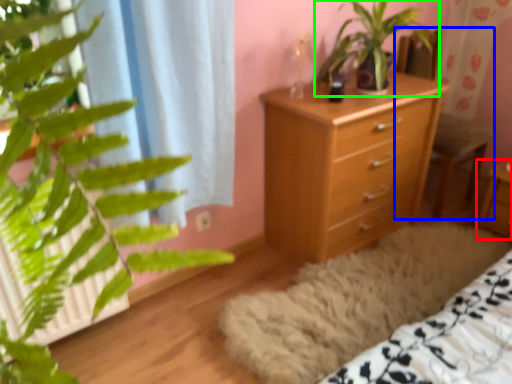
Question: Based on their relative distances, which object is farther from nightstand (highlighted by a red box)? Choose from armchair (highlighted by a blue box) and houseplant (highlighted by a green box).

Choices:
 (A) armchair
 (B) houseplant

Answer: (B)